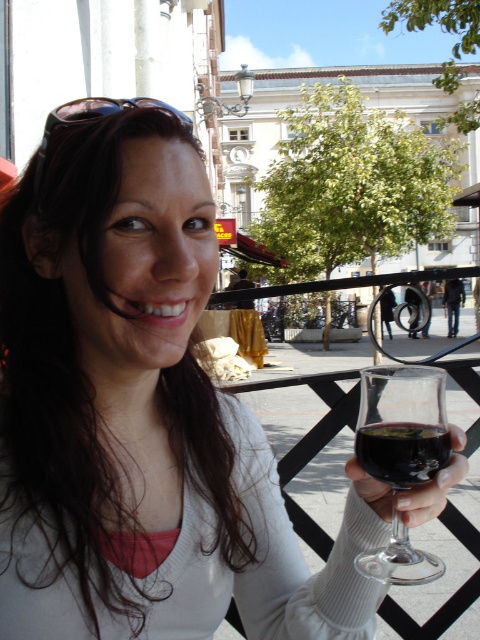
Can you confirm if transparent glass at lower right is wider than dark red liquid at lower right?

Yes, transparent glass at lower right is wider than dark red liquid at lower right.

Which of these two, transparent glass at lower right or dark red liquid at lower right, stands shorter?

dark red liquid at lower right is shorter.

Which is in front, point (424, 465) or point (396, 440)?

Point (396, 440)

Where is `transparent glass at lower right`? transparent glass at lower right is located at coordinates (402, 424).